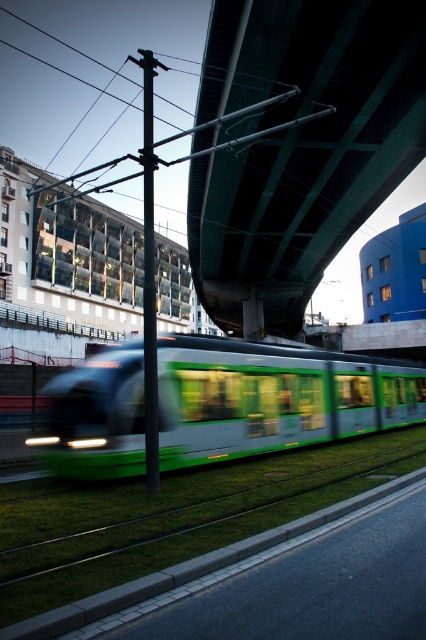
You are a drone operator who needs to fly a drone from the green concrete bridge at upper center to the green metallic train at center. The drone has a maximum flight distance of 12 meters. Based on the scene, can the drone reach the train?

The distance between the green concrete bridge at upper center and the green metallic train at center is 13.38 meters, which exceeds the drone operator maximum flight distance of 12 meters. The drone cannot reach the train.

You are a photographer trying to capture the green metallic train at center moving under the green concrete bridge at upper center. Based on their sizes in the image, which object would appear larger in your photo?

The green metallic train at center would appear larger in the photo because it is closer to the camera than the green concrete bridge at upper center, which is much taller but farther away.

You are a city planner analyzing this urban scene. You need to determine the exact coordinates of the green concrete bridge at upper center for a 3D modeling project. What are its coordinates?

The green concrete bridge at upper center is located at coordinates point (299, 145).